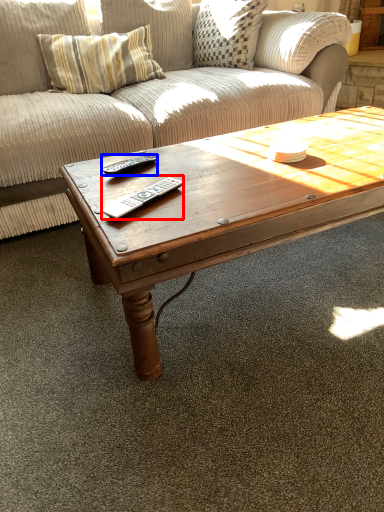
Question: Which point is closer to the camera, remote (highlighted by a red box) or remote (highlighted by a blue box)?

Choices:
 (A) remote
 (B) remote

Answer: (A)